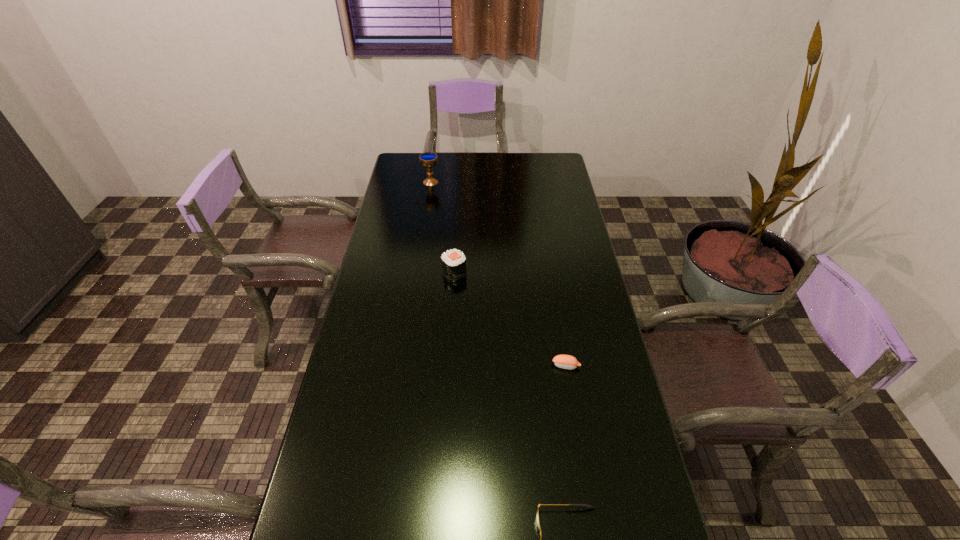
The image size is (960, 540). What are the coordinates of `vacant space in between the farther sushi and the chalice` in the screenshot? It's located at (443, 227).

Identify the location of empty space between the leftmost object and the right sushi. (498, 274).

Where is `vacant point located between the leftmost object and the taller sushi`? vacant point located between the leftmost object and the taller sushi is located at coordinates (443, 227).

Identify which object is the third nearest to the third nearest object. Please provide its 2D coordinates. Your answer should be formatted as a tuple, i.e. [(x, y)], where the tuple contains the x and y coordinates of a point satisfying the conditions above.

[(590, 506)]

Choose which object is the nearest neighbor to the chalice. Please provide its 2D coordinates. Your answer should be formatted as a tuple, i.e. [(x, y)], where the tuple contains the x and y coordinates of a point satisfying the conditions above.

[(453, 261)]